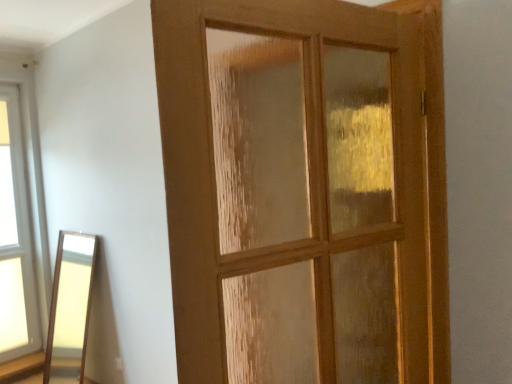
Question: Considering the positions of wooden door at center and clear glass window at left in the image, is wooden door at center wider or thinner than clear glass window at left?

Choices:
 (A) wide
 (B) thin

Answer: (A)

Question: In the image, is wooden door at center on the left side or the right side of clear glass window at left?

Choices:
 (A) left
 (B) right

Answer: (B)

Question: Does point (181, 16) appear closer or farther from the camera than point (28, 339)?

Choices:
 (A) closer
 (B) farther

Answer: (A)

Question: Considering the positions of clear glass window at left and wooden door at center in the image, is clear glass window at left taller or shorter than wooden door at center?

Choices:
 (A) tall
 (B) short

Answer: (A)

Question: Considering the positions of clear glass window at left and wooden door at center in the image, is clear glass window at left wider or thinner than wooden door at center?

Choices:
 (A) thin
 (B) wide

Answer: (A)

Question: Do you think clear glass window at left is within wooden door at center, or outside of it?

Choices:
 (A) inside
 (B) outside

Answer: (B)

Question: From a real-world perspective, is clear glass window at left positioned above or below wooden door at center?

Choices:
 (A) below
 (B) above

Answer: (A)